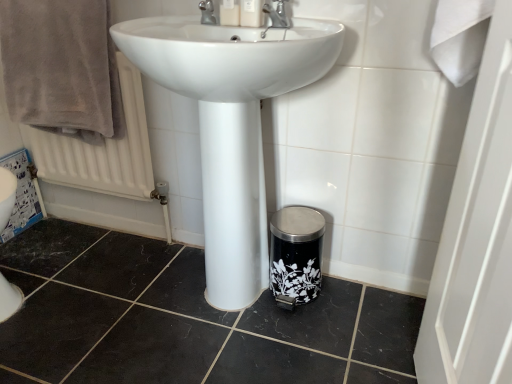
This screenshot has height=384, width=512. Find the location of `brown soft towel at upper left`. brown soft towel at upper left is located at coordinates (61, 67).

The height and width of the screenshot is (384, 512). What do you see at coordinates (184, 319) in the screenshot? I see `black marble tile at lower center` at bounding box center [184, 319].

Locate an element on the screen. The height and width of the screenshot is (384, 512). silver metallic tap at upper center, which ranks as the 1th tap in right-to-left order is located at coordinates (277, 14).

What do you see at coordinates (207, 12) in the screenshot? This screenshot has height=384, width=512. I see `silver metallic tap at upper center, which ranks as the second tap in right-to-left order` at bounding box center [207, 12].

Describe the element at coordinates (231, 124) in the screenshot. I see `white glossy sink at center` at that location.

Image resolution: width=512 pixels, height=384 pixels. In order to click on brown soft towel at upper left in this screenshot , I will do `click(61, 67)`.

Does white plastic soap dispenser at upper center, which is the second toiletry in left-to-right order, have a greater width compared to matte plastic soap dispenser at upper center, positioned as the first toiletry in left-to-right order?

Incorrect, the width of white plastic soap dispenser at upper center, which is the second toiletry in left-to-right order, does not surpass that of matte plastic soap dispenser at upper center, positioned as the first toiletry in left-to-right order.

Could you tell me if white plastic soap dispenser at upper center, which ranks as the first toiletry in right-to-left order, is turned towards matte plastic soap dispenser at upper center, positioned as the first toiletry in left-to-right order?

No, white plastic soap dispenser at upper center, which ranks as the first toiletry in right-to-left order, is not turned towards matte plastic soap dispenser at upper center, positioned as the first toiletry in left-to-right order.

Considering the sizes of objects white plastic soap dispenser at upper center, which ranks as the first toiletry in right-to-left order, and matte plastic soap dispenser at upper center, placed as the second toiletry when sorted from right to left, in the image provided, who is taller, white plastic soap dispenser at upper center, which ranks as the first toiletry in right-to-left order, or matte plastic soap dispenser at upper center, placed as the second toiletry when sorted from right to left,?

white plastic soap dispenser at upper center, which ranks as the first toiletry in right-to-left order, is taller.

Does silver metallic tap at upper center, which ranks as the second tap in right-to-left order, lie in front of white textured radiator at upper left?

Yes, silver metallic tap at upper center, which ranks as the second tap in right-to-left order, is in front of white textured radiator at upper left.

From the image's perspective, who appears lower, silver metallic tap at upper center, which ranks as the 1th tap in left-to-right order, or white textured radiator at upper left?

white textured radiator at upper left, from the image's perspective.

Which of these two, silver metallic tap at upper center, which ranks as the 1th tap in left-to-right order, or white textured radiator at upper left, is thinner?

white textured radiator at upper left.

In terms of size, does silver metallic tap at upper center, which ranks as the 1th tap in left-to-right order, appear bigger or smaller than white textured radiator at upper left?

Considering their sizes, silver metallic tap at upper center, which ranks as the 1th tap in left-to-right order, takes up less space than white textured radiator at upper left.

Could you tell me if silver metallic tap at upper center, which ranks as the 1th tap in right-to-left order, is facing brown soft towel at upper left?

No.

Would you say silver metallic tap at upper center, which ranks as the 1th tap in right-to-left order, is outside brown soft towel at upper left?

Yes.

From the image's perspective, is silver metallic tap at upper center, marked as the second tap in a left-to-right arrangement, located above or below brown soft towel at upper left?

Based on their image positions, silver metallic tap at upper center, marked as the second tap in a left-to-right arrangement, is located above brown soft towel at upper left.

Which object is further away from the camera taking this photo, black marble tile at lower center or white glossy sink at center?

black marble tile at lower center is more distant.

From the image's perspective, which one is positioned higher, black marble tile at lower center or white glossy sink at center?

white glossy sink at center is shown above in the image.

From the image's perspective, is matte plastic soap dispenser at upper center, positioned as the first toiletry in left-to-right order, under white glossy sink at center?

No, from the image's perspective, matte plastic soap dispenser at upper center, positioned as the first toiletry in left-to-right order, is not below white glossy sink at center.

Is point (232, 1) farther from viewer compared to point (207, 229)?

No.

Which of these two, matte plastic soap dispenser at upper center, placed as the second toiletry when sorted from right to left, or white glossy sink at center, stands taller?

With more height is white glossy sink at center.

Is matte plastic soap dispenser at upper center, placed as the second toiletry when sorted from right to left, directly adjacent to white glossy sink at center?

No, matte plastic soap dispenser at upper center, placed as the second toiletry when sorted from right to left, is not touching white glossy sink at center.

Based on the photo, considering the sizes of objects black marble tile at lower center and silver metallic tap at upper center, which ranks as the second tap in right-to-left order, in the image provided, who is shorter, black marble tile at lower center or silver metallic tap at upper center, which ranks as the second tap in right-to-left order,?

black marble tile at lower center is shorter.

From the image's perspective, is black marble tile at lower center above or below silver metallic tap at upper center, which ranks as the second tap in right-to-left order?

black marble tile at lower center is situated lower than silver metallic tap at upper center, which ranks as the second tap in right-to-left order, in the image.

From a real-world perspective, is black marble tile at lower center physically located above or below silver metallic tap at upper center, which ranks as the second tap in right-to-left order?

black marble tile at lower center is situated lower than silver metallic tap at upper center, which ranks as the second tap in right-to-left order, in the real world.

From the picture: Is white glossy sink at center aimed at silver metallic tap at upper center, which ranks as the 1th tap in right-to-left order?

No, white glossy sink at center is not facing towards silver metallic tap at upper center, which ranks as the 1th tap in right-to-left order.

Which is in front, point (234, 251) or point (288, 17)?

Positioned in front is point (288, 17).

In the image, is white glossy sink at center positioned in front of or behind silver metallic tap at upper center, which ranks as the 1th tap in right-to-left order?

Clearly, white glossy sink at center is in front of silver metallic tap at upper center, which ranks as the 1th tap in right-to-left order.

Does white glossy sink at center have a lesser height compared to silver metallic tap at upper center, marked as the second tap in a left-to-right arrangement?

No.

At what (x,y) coordinates should I click in order to perform the action: click on toiletry in front of the matte plastic soap dispenser at upper center, placed as the second toiletry when sorted from right to left. Please return your answer as a coordinate pair (x, y). Looking at the image, I should click on (251, 13).

Image resolution: width=512 pixels, height=384 pixels. What are the coordinates of `radiator to the left of silver metallic tap at upper center, which ranks as the second tap in right-to-left order` in the screenshot? It's located at click(x=101, y=150).

Based on their spatial positions, is silver metallic tap at upper center, marked as the second tap in a left-to-right arrangement, or silver metallic tap at upper center, which ranks as the 1th tap in left-to-right order, closer to brown soft towel at upper left?

silver metallic tap at upper center, which ranks as the 1th tap in left-to-right order, lies closer to brown soft towel at upper left than the other object.

Looking at the image, which one is located closer to white textured radiator at upper left, brown soft towel at upper left or matte plastic soap dispenser at upper center, placed as the second toiletry when sorted from right to left?

Based on the image, brown soft towel at upper left appears to be nearer to white textured radiator at upper left.

Considering their positions, is white glossy sink at center positioned further to black marble tile at lower center than silver metallic tap at upper center, which ranks as the 1th tap in right-to-left order?

Based on the image, silver metallic tap at upper center, which ranks as the 1th tap in right-to-left order, appears to be further to black marble tile at lower center.

Estimate the real-world distances between objects in this image. Which object is closer to white plastic soap dispenser at upper center, which is the second toiletry in left-to-right order, silver metallic tap at upper center, which ranks as the second tap in right-to-left order, or silver metallic tap at upper center, marked as the second tap in a left-to-right arrangement?

Among the two, silver metallic tap at upper center, marked as the second tap in a left-to-right arrangement, is located nearer to white plastic soap dispenser at upper center, which is the second toiletry in left-to-right order.

Looking at the image, which one is located closer to white glossy sink at center, black marble tile at lower center or brown soft towel at upper left?

brown soft towel at upper left lies closer to white glossy sink at center than the other object.

Consider the image. Which object lies further to the anchor point white glossy sink at center, brown soft towel at upper left or matte plastic soap dispenser at upper center, positioned as the first toiletry in left-to-right order?

brown soft towel at upper left.

From the image, which object appears to be nearer to silver metallic tap at upper center, marked as the second tap in a left-to-right arrangement, white plastic soap dispenser at upper center, which is the second toiletry in left-to-right order, or brown soft towel at upper left?

The object closer to silver metallic tap at upper center, marked as the second tap in a left-to-right arrangement, is white plastic soap dispenser at upper center, which is the second toiletry in left-to-right order.

Which object lies nearer to the anchor point white glossy sink at center, silver metallic tap at upper center, which ranks as the second tap in right-to-left order, or brown soft towel at upper left?

silver metallic tap at upper center, which ranks as the second tap in right-to-left order, is closer to white glossy sink at center.

At what (x,y) coordinates should I click in order to perform the action: click on bath towel between silver metallic tap at upper center, which ranks as the 1th tap in left-to-right order, and black marble tile at lower center, in the vertical direction. Please return your answer as a coordinate pair (x, y). Looking at the image, I should click on (61, 67).

Where is `tap situated between brown soft towel at upper left and white glossy sink at center from left to right`? This screenshot has height=384, width=512. tap situated between brown soft towel at upper left and white glossy sink at center from left to right is located at coordinates (207, 12).

Where is `sink between white textured radiator at upper left and silver metallic tap at upper center, marked as the second tap in a left-to-right arrangement`? This screenshot has height=384, width=512. sink between white textured radiator at upper left and silver metallic tap at upper center, marked as the second tap in a left-to-right arrangement is located at coordinates (231, 124).

Where is `radiator between matte plastic soap dispenser at upper center, placed as the second toiletry when sorted from right to left, and black marble tile at lower center vertically`? Image resolution: width=512 pixels, height=384 pixels. radiator between matte plastic soap dispenser at upper center, placed as the second toiletry when sorted from right to left, and black marble tile at lower center vertically is located at coordinates (101, 150).